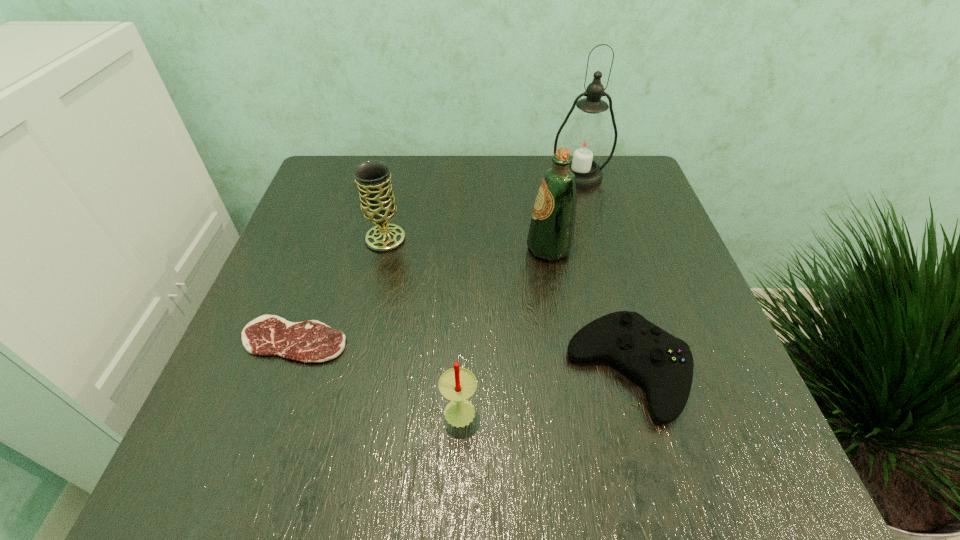
I want to click on empty space between the steak and the tallest object, so click(437, 258).

This screenshot has width=960, height=540. Identify the location of blank region between the control and the chalice. (507, 305).

Where is `empty space that is in between the chalice and the fifth tallest object`? Image resolution: width=960 pixels, height=540 pixels. empty space that is in between the chalice and the fifth tallest object is located at coordinates (507, 305).

This screenshot has height=540, width=960. I want to click on free space between the fifth tallest object and the third tallest object, so click(x=507, y=305).

You are a GUI agent. You are given a task and a screenshot of the screen. Output one action in this format:
    pyautogui.click(x=<x>, y=<y>)
    Task: Click on the vacant area between the second tallest object and the fourth tallest object
    This screenshot has height=540, width=960.
    Given the screenshot: What is the action you would take?
    [504, 328]

This screenshot has width=960, height=540. I want to click on vacant space that's between the control and the olive oil, so click(x=588, y=309).

The image size is (960, 540). In order to click on free spot between the oil lamp and the candle in this screenshot , I will do coord(519,293).

In order to click on the closest object to the chalice in this screenshot , I will do `click(309, 341)`.

Locate which object is the third closest to the olive oil. Please provide its 2D coordinates. Your answer should be formatted as a tuple, i.e. [(x, y)], where the tuple contains the x and y coordinates of a point satisfying the conditions above.

[(372, 177)]

Locate an element on the screen. This screenshot has height=540, width=960. vacant position in the image that satisfies the following two spatial constraints: 1. on the front side of the control; 2. on the left side of the shortest object is located at coordinates (283, 371).